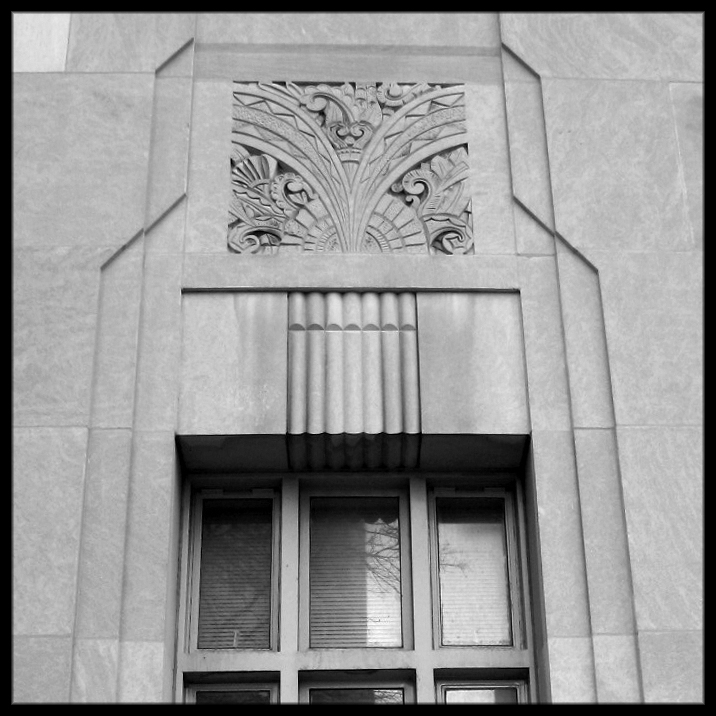
Identify the location of blinds. (358, 595).